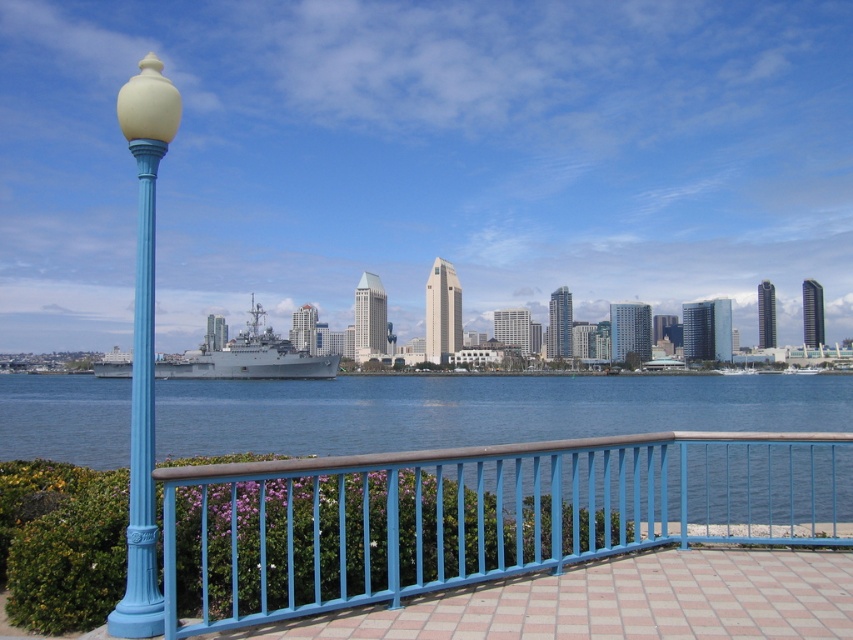
Question: Is blue painted metal railing at center closer to the viewer compared to matte blue pole at left?

Choices:
 (A) no
 (B) yes

Answer: (B)

Question: Does matte blue pole at left have a smaller size compared to gray metallic ship at center?

Choices:
 (A) yes
 (B) no

Answer: (A)

Question: Which point appears farthest from the camera in this image?

Choices:
 (A) (131, 589)
 (B) (7, 422)

Answer: (B)

Question: Which object appears farthest from the camera in this image?

Choices:
 (A) gray metallic ship at center
 (B) blue painted metal railing at center

Answer: (A)

Question: Among these points, which one is farthest from the camera?

Choices:
 (A) (590, 524)
 (B) (131, 124)
 (C) (703, 413)
 (D) (212, 364)

Answer: (D)

Question: Is blue water at center closer to the viewer compared to gray metallic ship at center?

Choices:
 (A) yes
 (B) no

Answer: (B)